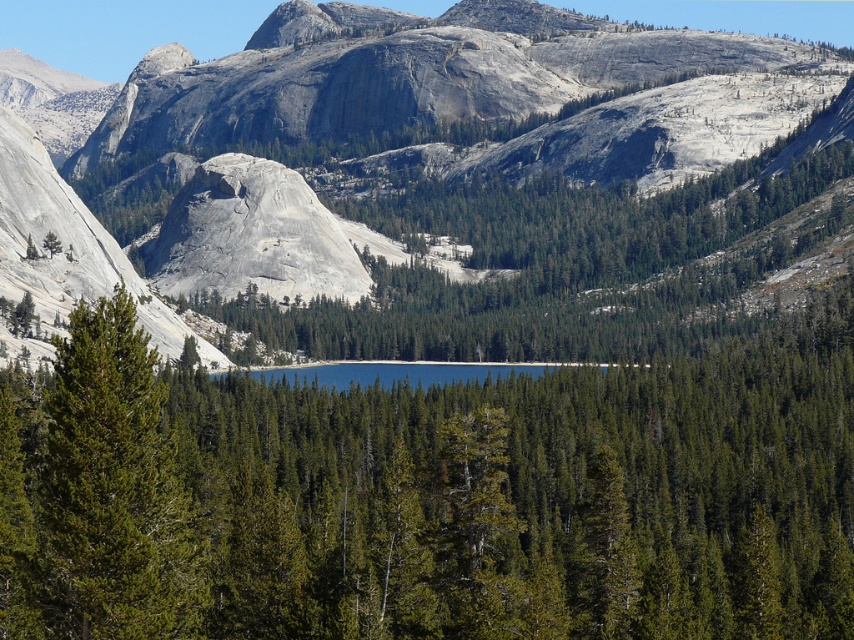
Question: Estimate the real-world distances between objects in this image. Which object is closer to the matte gray rock at center?

Choices:
 (A) green needle-like at left
 (B) green matte tree at center

Answer: (B)

Question: Does matte gray rock at center come in front of green needle-like at left?

Choices:
 (A) no
 (B) yes

Answer: (A)

Question: Can you confirm if matte gray rock at center is thinner than green matte tree at center?

Choices:
 (A) yes
 (B) no

Answer: (B)

Question: Is green matte tree at center positioned in front of green needle-like at left?

Choices:
 (A) no
 (B) yes

Answer: (A)

Question: Which object is closer to the camera taking this photo?

Choices:
 (A) matte gray rock at center
 (B) green matte tree at center
 (C) green needle-like at left

Answer: (C)

Question: Among these objects, which one is farthest from the camera?

Choices:
 (A) green matte tree at center
 (B) green needle-like at left
 (C) matte gray rock at center

Answer: (C)